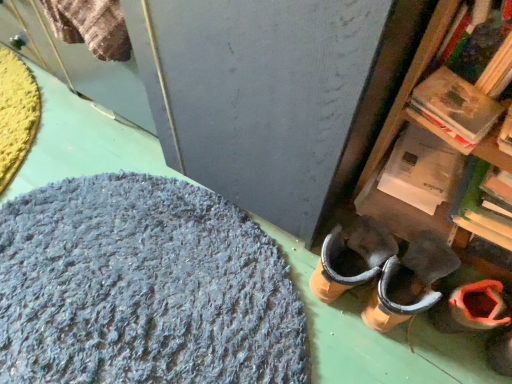
Describe the element at coordinates (143, 288) in the screenshot. This screenshot has height=384, width=512. I see `shaggy gray rug at lower left` at that location.

Where is `shaggy gray rug at lower left`? This screenshot has height=384, width=512. shaggy gray rug at lower left is located at coordinates (143, 288).

What do you see at coordinates (471, 308) in the screenshot?
I see `orange suede boot at lower right` at bounding box center [471, 308].

Measure the distance between point (497, 282) and camera.

They are 38.07 inches apart.

You are a GUI agent. You are given a task and a screenshot of the screen. Output one action in this format:
    pyautogui.click(x=<x>, y=<y>)
    Task: Click on the orange suede boot at lower right
    The image size is (512, 384).
    Given the screenshot: What is the action you would take?
    pyautogui.click(x=471, y=308)

What is the approximate width of orange suede boot at lower right?

orange suede boot at lower right is 11.45 inches in width.

You are a GUI agent. You are given a task and a screenshot of the screen. Output one action in this format:
    pyautogui.click(x=<x>, y=<y>)
    Task: Click on the shaggy gray rug at lower left
    
    Given the screenshot: What is the action you would take?
    143,288

Is orange suede boot at lower right to the left of shaggy gray rug at lower left from the viewer's perspective?

In fact, orange suede boot at lower right is to the right of shaggy gray rug at lower left.

Between orange suede boot at lower right and shaggy gray rug at lower left, which one is positioned in front?

Positioned in front is shaggy gray rug at lower left.

Which point is more forward, (458, 317) or (209, 339)?

The point (458, 317) is closer to the camera.

From the image's perspective, relative to shaggy gray rug at lower left, is orange suede boot at lower right above or below?

orange suede boot at lower right is below shaggy gray rug at lower left.

From a real-world perspective, which object stands above the other?

In real-world perspective, orange suede boot at lower right is above.

Which of these two, orange suede boot at lower right or shaggy gray rug at lower left, is thinner?

orange suede boot at lower right is thinner.

Does orange suede boot at lower right have a lesser height compared to shaggy gray rug at lower left?

In fact, orange suede boot at lower right may be taller than shaggy gray rug at lower left.

Which of these two, orange suede boot at lower right or shaggy gray rug at lower left, is bigger?

shaggy gray rug at lower left is bigger.

Is shaggy gray rug at lower left a part of orange suede boot at lower right?

Definitely not — shaggy gray rug at lower left is not inside orange suede boot at lower right.

Is orange suede boot at lower right placed right next to shaggy gray rug at lower left?

They are not placed beside each other.

Does orange suede boot at lower right turn towards shaggy gray rug at lower left?

No, orange suede boot at lower right is not aimed at shaggy gray rug at lower left.

You are a GUI agent. You are given a task and a screenshot of the screen. Output one action in this format:
    pyautogui.click(x=<x>, y=<y>)
    Task: Click on the wool located in front of the orange suede boot at lower right
    
    Given the screenshot: What is the action you would take?
    pyautogui.click(x=143, y=288)

Between shaggy gray rug at lower left and orange suede boot at lower right, which one appears on the left side from the viewer's perspective?

shaggy gray rug at lower left is more to the left.

Looking at this image, which object is further away from the camera, shaggy gray rug at lower left or orange suede boot at lower right?

orange suede boot at lower right is more distant.

Which is nearer, (231, 353) or (490, 309)?

The point (490, 309) is closer.

From the image's perspective, is shaggy gray rug at lower left beneath orange suede boot at lower right?

No.

From a real-world perspective, relative to orange suede boot at lower right, is shaggy gray rug at lower left vertically above or below?

In terms of real-world spatial position, shaggy gray rug at lower left is below orange suede boot at lower right.

Which object is wider, shaggy gray rug at lower left or orange suede boot at lower right?

Wider between the two is shaggy gray rug at lower left.

Considering the relative sizes of shaggy gray rug at lower left and orange suede boot at lower right in the image provided, is shaggy gray rug at lower left shorter than orange suede boot at lower right?

Correct, shaggy gray rug at lower left is not as tall as orange suede boot at lower right.

From the picture: Between shaggy gray rug at lower left and orange suede boot at lower right, which one has smaller size?

Smaller between the two is orange suede boot at lower right.

Could orange suede boot at lower right be considered to be inside shaggy gray rug at lower left?

No, orange suede boot at lower right is not inside shaggy gray rug at lower left.

Are shaggy gray rug at lower left and orange suede boot at lower right located far from each other?

No.

Is shaggy gray rug at lower left aimed at orange suede boot at lower right?

No.

How different are the orientations of shaggy gray rug at lower left and orange suede boot at lower right in degrees?

The angle between the facing direction of shaggy gray rug at lower left and the facing direction of orange suede boot at lower right is 31.2 degrees.

The height and width of the screenshot is (384, 512). In order to click on wool below the orange suede boot at lower right (from a real-world perspective) in this screenshot , I will do `click(143, 288)`.

The width and height of the screenshot is (512, 384). I want to click on wool that appears in front of the orange suede boot at lower right, so (143, 288).

At what (x,y) coordinates should I click in order to perform the action: click on footwear below the shaggy gray rug at lower left (from the image's perspective). Please return your answer as a coordinate pair (x, y). This screenshot has height=384, width=512. Looking at the image, I should click on (471, 308).